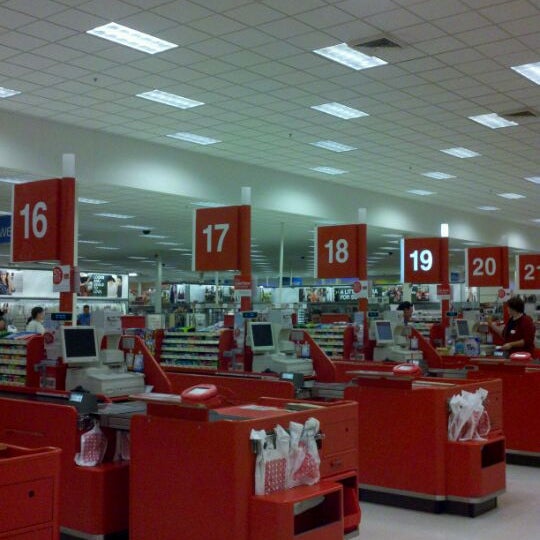
You are a GUI agent. You are given a task and a screenshot of the screen. Output one action in this format:
    pyautogui.click(x=<x>, y=<y>)
    Task: Click on the ceiling lights
    Image resolution: width=540 pixels, height=540 pixels.
    Given the screenshot: What is the action you would take?
    pyautogui.click(x=175, y=103)